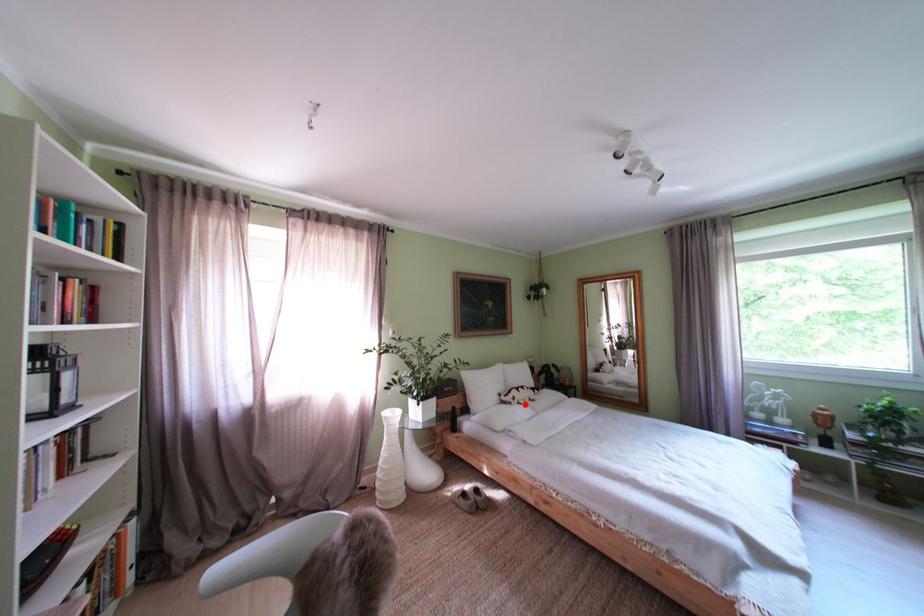
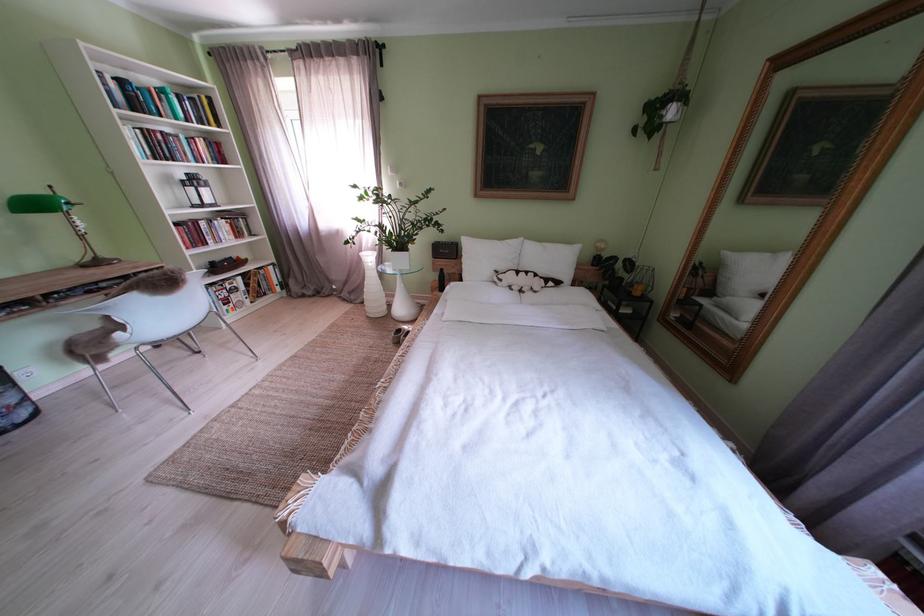
The point at the highlighted location is marked in the first image. Where is the corresponding point in the second image?

(512, 285)